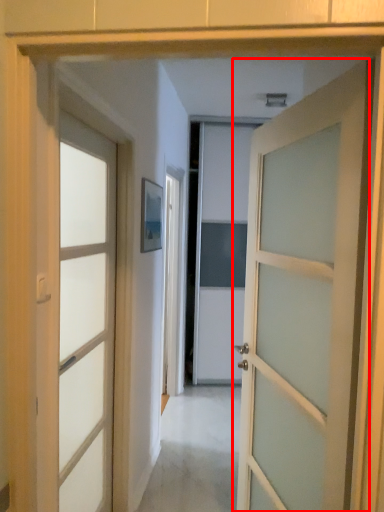
Question: In this image, where is door (annotated by the red box) located relative to door?

Choices:
 (A) left
 (B) right

Answer: (B)